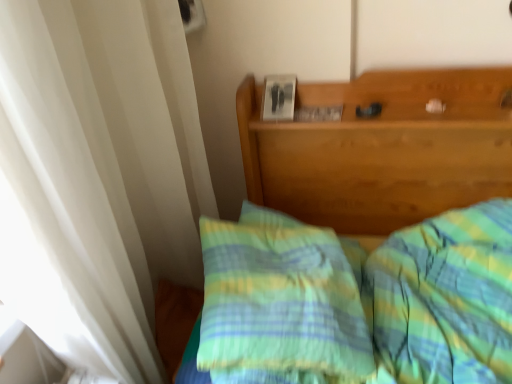
Locate an element on the screen. green striped pillow at center is located at coordinates (279, 303).

What do you see at coordinates (279, 303) in the screenshot? I see `green striped pillow at center` at bounding box center [279, 303].

Measure the distance between green striped pillow at center and camera.

A distance of 30.52 inches exists between green striped pillow at center and camera.

In order to face green striped pillow at center, should I rotate leftwards or rightwards?

A 3.095 degree turn to the right will do.

Describe the element at coordinates (381, 150) in the screenshot. I see `green plaid bedspread at center` at that location.

Where is `green plaid bedspread at center`? Image resolution: width=512 pixels, height=384 pixels. green plaid bedspread at center is located at coordinates (381, 150).

Where is `green striped pillow at center`? This screenshot has height=384, width=512. green striped pillow at center is located at coordinates (279, 303).

Considering the relative positions of green striped pillow at center and green plaid bedspread at center in the image provided, is green striped pillow at center to the left of green plaid bedspread at center from the viewer's perspective?

Yes.

Considering the positions of objects green striped pillow at center and green plaid bedspread at center in the image provided, who is behind, green striped pillow at center or green plaid bedspread at center?

green striped pillow at center is further away from the camera.

Does point (358, 336) come closer to viewer compared to point (415, 178)?

Yes, point (358, 336) is closer to viewer.

From the image's perspective, does green striped pillow at center appear higher than green plaid bedspread at center?

→ Indeed, from the image's perspective, green striped pillow at center is shown above green plaid bedspread at center.

From a real-world perspective, which object stands above the other?

green striped pillow at center.

Considering the relative sizes of green striped pillow at center and green plaid bedspread at center in the image provided, is green striped pillow at center wider than green plaid bedspread at center?

No, green striped pillow at center is not wider than green plaid bedspread at center.

Who is taller, green striped pillow at center or green plaid bedspread at center?

green plaid bedspread at center is taller.

Between green striped pillow at center and green plaid bedspread at center, which one has smaller size?

Smaller between the two is green striped pillow at center.

Consider the image. Which is correct: green striped pillow at center is inside green plaid bedspread at center, or outside of it?

green striped pillow at center is located inside green plaid bedspread at center.

Is there a large distance between green striped pillow at center and green plaid bedspread at center?

They are positioned close to each other.

Looking at this image, does green striped pillow at center turn towards green plaid bedspread at center?

Yes, green striped pillow at center is facing green plaid bedspread at center.

What's the angular difference between green striped pillow at center and green plaid bedspread at center's facing directions?

111 degrees separate the facing orientations of green striped pillow at center and green plaid bedspread at center.

How distant is green striped pillow at center from green plaid bedspread at center?

They are 17.07 inches apart.

The image size is (512, 384). I want to click on bed on the right side of green striped pillow at center, so click(381, 150).

Between green plaid bedspread at center and green striped pillow at center, which one appears on the right side from the viewer's perspective?

From the viewer's perspective, green plaid bedspread at center appears more on the right side.

Considering their positions, is green plaid bedspread at center located in front of or behind green striped pillow at center?

In the image, green plaid bedspread at center appears in front of green striped pillow at center.

Considering the points (335, 86) and (308, 230), which point is behind, point (335, 86) or point (308, 230)?

Point (335, 86)

From the image's perspective, which one is positioned lower, green plaid bedspread at center or green striped pillow at center?

From the image's view, green plaid bedspread at center is below.

From a real-world perspective, who is located higher, green plaid bedspread at center or green striped pillow at center?

green striped pillow at center, from a real-world perspective.

Considering the relative sizes of green plaid bedspread at center and green striped pillow at center in the image provided, is green plaid bedspread at center thinner than green striped pillow at center?

No.

In the scene shown: Between green plaid bedspread at center and green striped pillow at center, which one has less height?

Standing shorter between the two is green striped pillow at center.

Is green plaid bedspread at center bigger than green striped pillow at center?

Yes, green plaid bedspread at center is bigger than green striped pillow at center.

Does green plaid bedspread at center contain green striped pillow at center?

Yes, green striped pillow at center is inside green plaid bedspread at center.

Is green plaid bedspread at center touching green striped pillow at center?

No.

Is green plaid bedspread at center oriented away from green striped pillow at center?

No, green plaid bedspread at center is not facing the opposite direction of green striped pillow at center.

Image resolution: width=512 pixels, height=384 pixels. In order to click on pillow above the green plaid bedspread at center (from the image's perspective) in this screenshot , I will do `click(279, 303)`.

This screenshot has width=512, height=384. What are the coordinates of `bed lying on the right of green striped pillow at center` in the screenshot? It's located at (381, 150).

What are the coordinates of `pillow to the left of green plaid bedspread at center` in the screenshot? It's located at (279, 303).